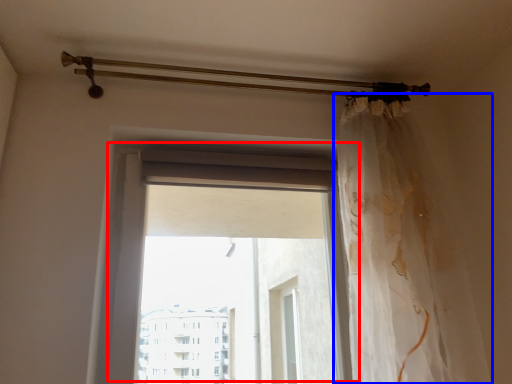
Question: Which point is further to the camera, window (highlighted by a red box) or curtain (highlighted by a blue box)?

Choices:
 (A) window
 (B) curtain

Answer: (A)